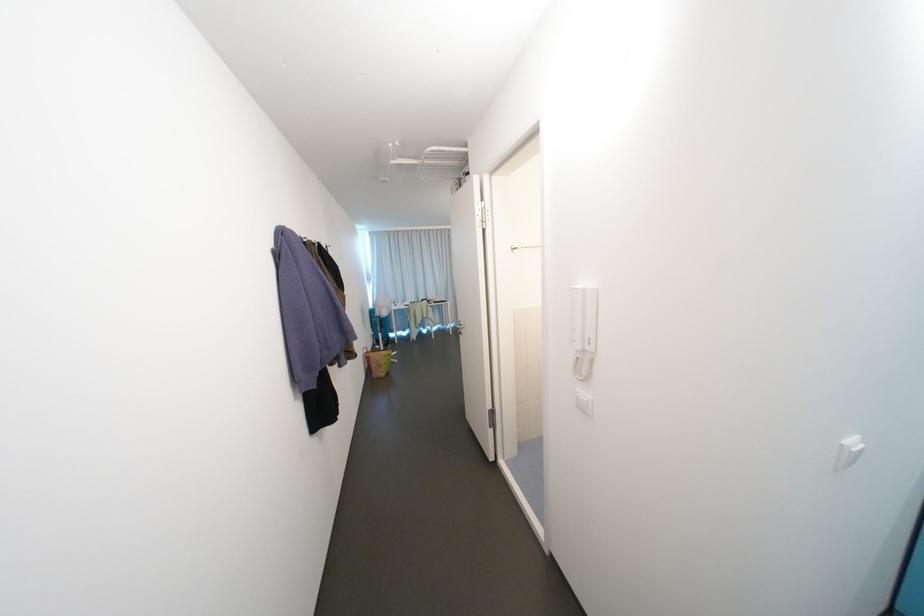
At what (x,y) coordinates should I click in order to perform the action: click on coat hook. Please return your answer as a coordinate pair (x, y). Looking at the image, I should click on (523, 246).